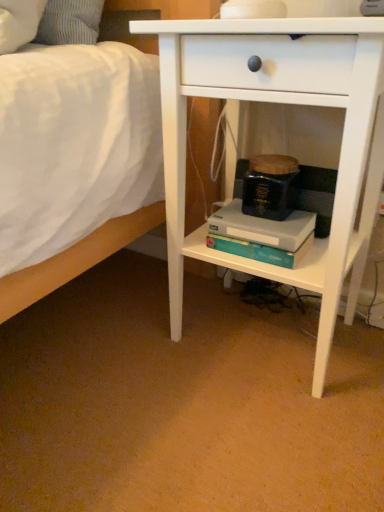
Locate an element on the screen. This screenshot has height=512, width=384. vacant region to the left of white matte nightstand at center is located at coordinates (105, 347).